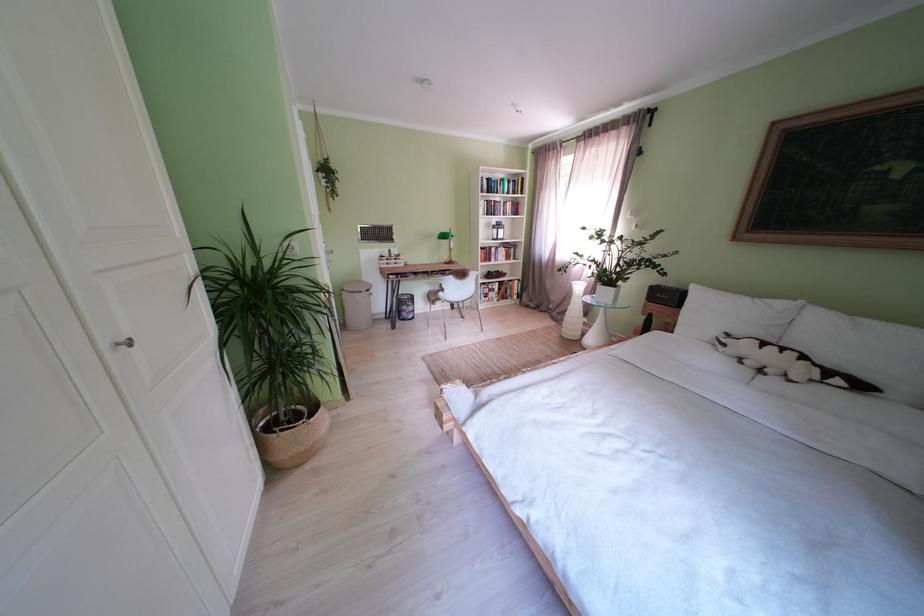
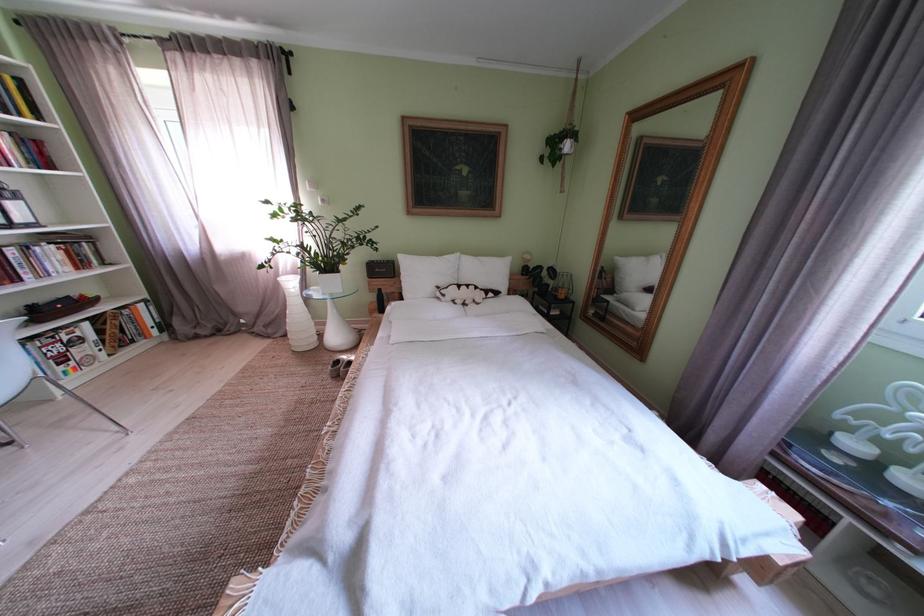
Find the pixel in the second image that matches pixel 578 323 in the first image.

(301, 334)